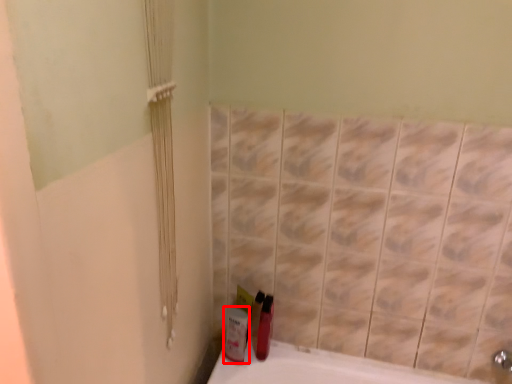
Question: Observing the image, what is the correct spatial positioning of mouthwash (annotated by the red box) in reference to mouthwash?

Choices:
 (A) right
 (B) left

Answer: (B)